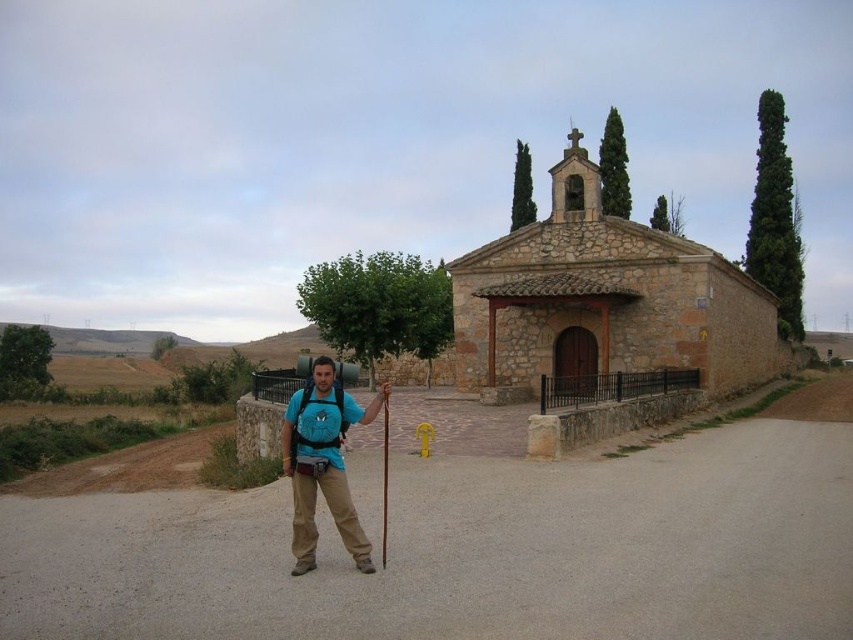
You are a photographer planning to capture the brown stone church at center and the blue fabric backpack at center in a single frame. Considering the spatial relationship between them, which object should you position closer to the camera to ensure both fit within the frame?

The brown stone church at center is wider than the blue fabric backpack at center. To fit both in the frame, position the brown stone church at center closer to the camera so its larger width occupies less space in the frame due to perspective, allowing the blue fabric backpack at center to also be included.

You are a hiker who wants to place your blue fabric backpack at center on the dirt track at center. Can you fit it there without it hanging off the edge?

The dirt track at center has a larger size compared to the blue fabric backpack at center, so yes, the backpack can be placed there without hanging off the edge.